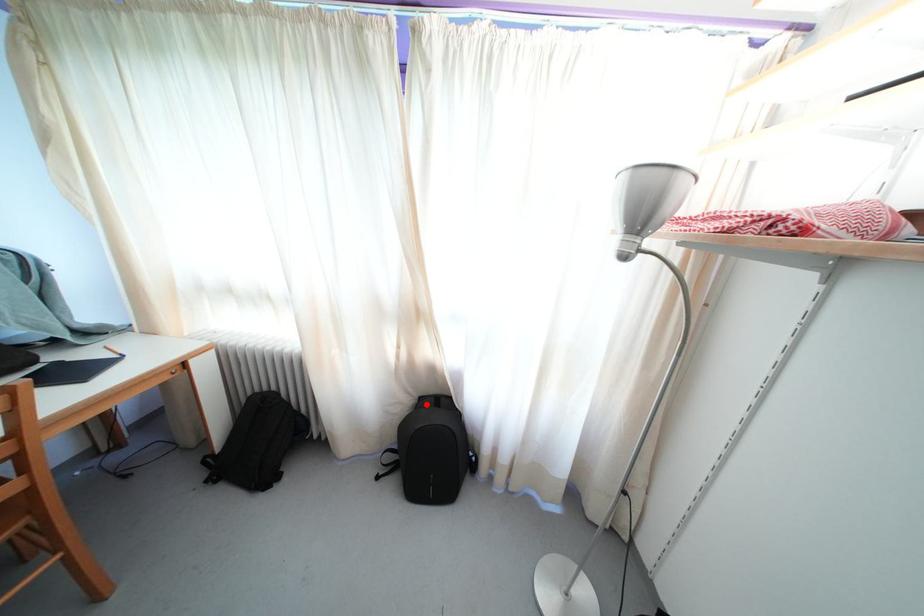
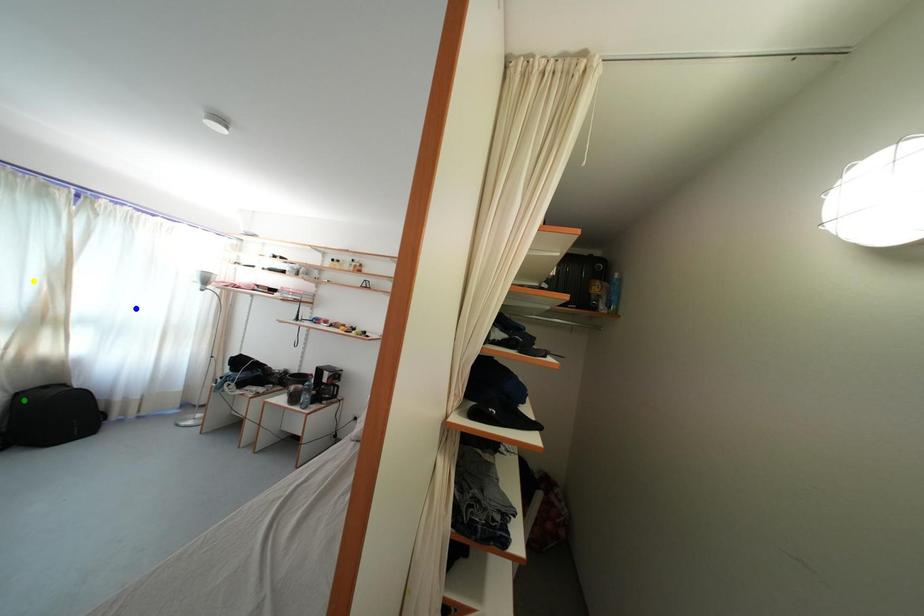
Question: I am providing you with two images of the same scene from different viewpoints. A red point is marked on the first image. You are given multiple points on the second image. Can you choose the point in image 2 that corresponds to the point in image 1?

Choices:
 (A) blue point
 (B) yellow point
 (C) green point

Answer: (C)